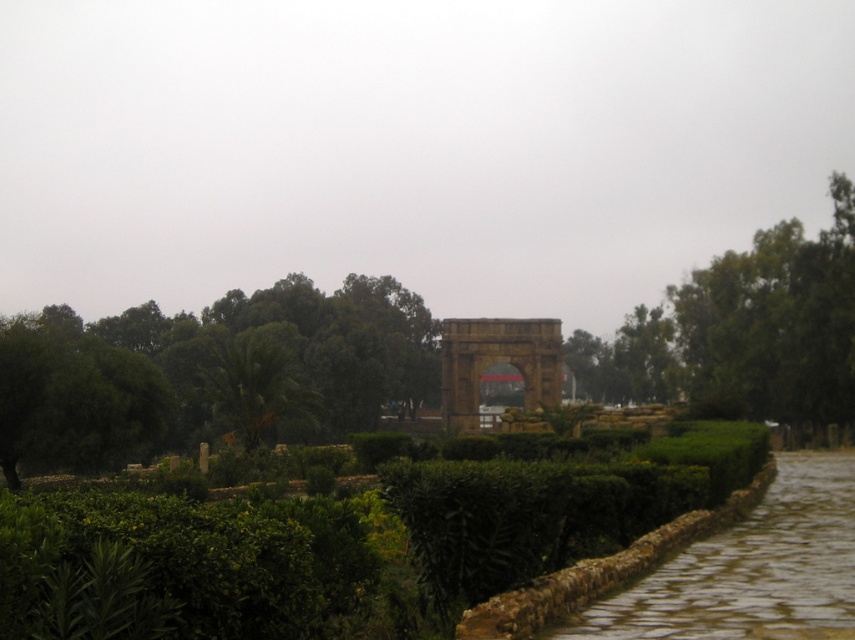
Is green leafy hedge at center above green leafy tree at center?

No, green leafy hedge at center is not above green leafy tree at center.

Which is behind, point (357, 572) or point (202, 337)?

The point (202, 337) is more distant.

Find the location of `green leafy hedge at center`. green leafy hedge at center is located at coordinates (187, 564).

Can you confirm if green leafy hedge at center is smaller than green leafy tree at upper right?

Yes, green leafy hedge at center is smaller than green leafy tree at upper right.

Which is in front, point (425, 547) or point (776, 288)?

Point (425, 547) is in front.

Is point (145, 504) farther from viewer compared to point (697, 294)?

That is False.

Locate an element on the screen. Image resolution: width=855 pixels, height=640 pixels. green leafy hedge at center is located at coordinates (187, 564).

Between point (610, 477) and point (252, 348), which one is positioned in front?

Point (610, 477)

Does green leafy hedge at center come behind green leafy tree at left?

No, green leafy hedge at center is closer to the viewer.

Between point (118, 524) and point (320, 352), which one is positioned behind?

Point (320, 352)

Where is `green leafy hedge at center`? The height and width of the screenshot is (640, 855). green leafy hedge at center is located at coordinates (187, 564).